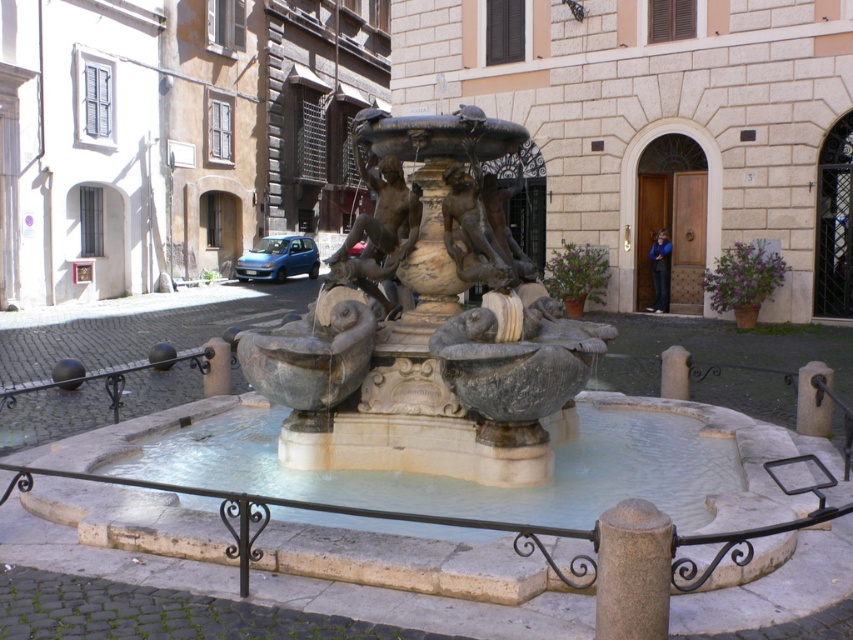
You are standing in front of the fountain and want to take a photo of both the bronze statue at center and the gray stone pillar at center. Which one should you position to your left side to capture both in the frame?

You should position the bronze statue at center to your left side because the bronze statue at center is already to the left of gray stone pillar at center, so aligning it that way will ensure both are in the frame.

You are standing in front of the fountain and want to take a photo. You notice two points marked in the image. The first point is at coordinate point (428,458) and the second is at point (679,390). Which point is closer to you when you are facing the fountain?

Point (428,458) is closer to the camera than point (679,390), so the first point is closer to you when facing the fountain.